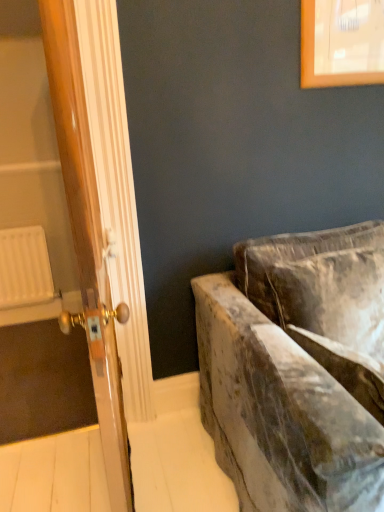
Question: Is white plastic radiator at left behind velvet couch at right?

Choices:
 (A) no
 (B) yes

Answer: (B)

Question: From a real-world perspective, is white plastic radiator at left positioned under velvet couch at right based on gravity?

Choices:
 (A) yes
 (B) no

Answer: (A)

Question: Can you confirm if white plastic radiator at left is thinner than velvet couch at right?

Choices:
 (A) no
 (B) yes

Answer: (B)

Question: Is white plastic radiator at left facing away from velvet couch at right?

Choices:
 (A) no
 (B) yes

Answer: (A)

Question: Does white plastic radiator at left have a greater width compared to velvet couch at right?

Choices:
 (A) no
 (B) yes

Answer: (A)

Question: From a real-world perspective, relative to wooden door at left, is white plastic radiator at left vertically above or below?

Choices:
 (A) below
 (B) above

Answer: (A)

Question: From the image's perspective, is white plastic radiator at left located above or below wooden door at left?

Choices:
 (A) above
 (B) below

Answer: (B)

Question: Based on their positions, is white plastic radiator at left located to the left or right of wooden door at left?

Choices:
 (A) left
 (B) right

Answer: (A)

Question: Do you think white plastic radiator at left is within wooden door at left, or outside of it?

Choices:
 (A) inside
 (B) outside

Answer: (B)

Question: Based on their sizes in the image, would you say velvet couch at right is bigger or smaller than white plastic radiator at left?

Choices:
 (A) small
 (B) big

Answer: (B)

Question: Looking at their shapes, would you say velvet couch at right is wider or thinner than white plastic radiator at left?

Choices:
 (A) thin
 (B) wide

Answer: (B)

Question: From the image's perspective, is velvet couch at right located above or below white plastic radiator at left?

Choices:
 (A) above
 (B) below

Answer: (B)

Question: In the image, is velvet couch at right on the left side or the right side of white plastic radiator at left?

Choices:
 (A) right
 (B) left

Answer: (A)

Question: Visually, is white plastic radiator at left positioned to the left or to the right of velvet couch at right?

Choices:
 (A) left
 (B) right

Answer: (A)

Question: From a real-world perspective, is white plastic radiator at left above or below velvet couch at right?

Choices:
 (A) above
 (B) below

Answer: (B)